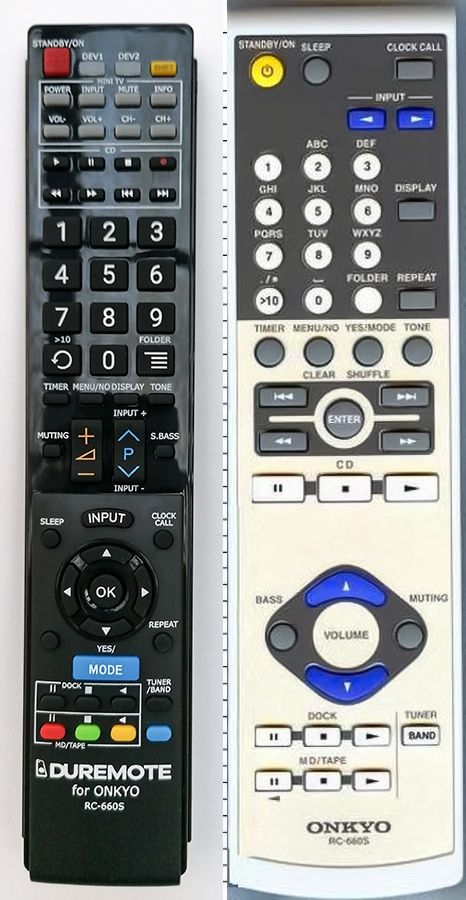
I want to click on remote controls, so click(x=272, y=561), click(x=98, y=499).